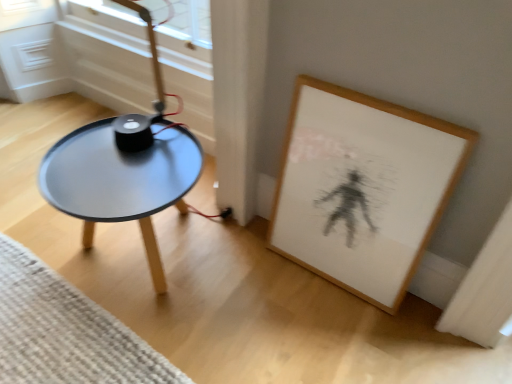
Where is `woven beige mat at lower left`? The height and width of the screenshot is (384, 512). woven beige mat at lower left is located at coordinates (65, 331).

Find the location of `wooden framed artwork at lower right`. wooden framed artwork at lower right is located at coordinates (366, 186).

This screenshot has width=512, height=384. Identify the location of woven beige mat at lower left. (65, 331).

From a real-world perspective, which is physically below, wooden framed artwork at lower right or matte black table at left?

matte black table at left, from a real-world perspective.

Considering the relative positions of wooden framed artwork at lower right and matte black table at left in the image provided, is wooden framed artwork at lower right to the right of matte black table at left from the viewer's perspective?

Yes, wooden framed artwork at lower right is to the right of matte black table at left.

Is wooden framed artwork at lower right touching matte black table at left?

No, wooden framed artwork at lower right is not making contact with matte black table at left.

Consider the image. Considering the sizes of objects wooden framed artwork at lower right and woven beige mat at lower left in the image provided, who is shorter, wooden framed artwork at lower right or woven beige mat at lower left?

With less height is woven beige mat at lower left.

Can you see wooden framed artwork at lower right touching woven beige mat at lower left?

wooden framed artwork at lower right and woven beige mat at lower left are not in contact.

From the picture: Is wooden framed artwork at lower right wider or thinner than woven beige mat at lower left?

Considering their sizes, wooden framed artwork at lower right looks slimmer than woven beige mat at lower left.

Considering the positions of objects wooden framed artwork at lower right and woven beige mat at lower left in the image provided, who is more to the right, wooden framed artwork at lower right or woven beige mat at lower left?

From the viewer's perspective, wooden framed artwork at lower right appears more on the right side.

Can you tell me how much woven beige mat at lower left and matte black table at left differ in facing direction?

The angle between the facing direction of woven beige mat at lower left and the facing direction of matte black table at left is 91.9 degrees.

In order to click on mat located on the left of matte black table at left in this screenshot , I will do click(x=65, y=331).

Considering the sizes of objects woven beige mat at lower left and matte black table at left in the image provided, who is smaller, woven beige mat at lower left or matte black table at left?

woven beige mat at lower left is smaller.

Can you see woven beige mat at lower left touching matte black table at left?

No, woven beige mat at lower left is not making contact with matte black table at left.

From a real-world perspective, is matte black table at left physically above woven beige mat at lower left?

Yes.

Is matte black table at left taller or shorter than woven beige mat at lower left?

matte black table at left is taller than woven beige mat at lower left.

From the image's perspective, is matte black table at left beneath woven beige mat at lower left?

Incorrect, from the image's perspective, matte black table at left is higher than woven beige mat at lower left.

Can you confirm if matte black table at left is bigger than woven beige mat at lower left?

Yes, matte black table at left is bigger than woven beige mat at lower left.

Is woven beige mat at lower left positioned far away from wooden framed artwork at lower right?

They are positioned close to each other.

Locate an element on the screen. The height and width of the screenshot is (384, 512). mat on the left side of wooden framed artwork at lower right is located at coordinates (65, 331).

What's the angular difference between woven beige mat at lower left and wooden framed artwork at lower right's facing directions?

woven beige mat at lower left and wooden framed artwork at lower right are facing 91 degrees away from each other.

Is point (63, 381) less distant than point (296, 230)?

Yes, point (63, 381) is closer to viewer.

You are a GUI agent. You are given a task and a screenshot of the screen. Output one action in this format:
    pyautogui.click(x=<x>, y=<y>)
    Task: Click on the picture frame above the matte black table at left (from the image's perspective)
    The width and height of the screenshot is (512, 384).
    Given the screenshot: What is the action you would take?
    pyautogui.click(x=366, y=186)

From the image's perspective, would you say matte black table at left is shown under wooden framed artwork at lower right?

Correct, matte black table at left appears lower than wooden framed artwork at lower right in the image.

Is matte black table at left positioned in front of wooden framed artwork at lower right?

No, matte black table at left is further to the viewer.

Consider the image. Is matte black table at left next to wooden framed artwork at lower right?

No.

Where is `coffee table lying on the left of wooden framed artwork at lower right`? This screenshot has height=384, width=512. coffee table lying on the left of wooden framed artwork at lower right is located at coordinates (120, 181).

The height and width of the screenshot is (384, 512). In order to click on picture frame above the woven beige mat at lower left (from the image's perspective) in this screenshot , I will do `click(366, 186)`.

Estimate the real-world distances between objects in this image. Which object is closer to woven beige mat at lower left, wooden framed artwork at lower right or matte black table at left?

Based on the image, matte black table at left appears to be nearer to woven beige mat at lower left.

Estimate the real-world distances between objects in this image. Which object is further from woven beige mat at lower left, matte black table at left or wooden framed artwork at lower right?

Based on the image, wooden framed artwork at lower right appears to be further to woven beige mat at lower left.

Estimate the real-world distances between objects in this image. Which object is further from wooden framed artwork at lower right, woven beige mat at lower left or matte black table at left?

woven beige mat at lower left is positioned further to the anchor wooden framed artwork at lower right.

Based on their spatial positions, is woven beige mat at lower left or wooden framed artwork at lower right further from matte black table at left?

Among the two, wooden framed artwork at lower right is located further to matte black table at left.

Looking at the image, which one is located further to matte black table at left, wooden framed artwork at lower right or woven beige mat at lower left?

wooden framed artwork at lower right lies further to matte black table at left than the other object.

Which object lies nearer to the anchor point wooden framed artwork at lower right, matte black table at left or woven beige mat at lower left?

The object closer to wooden framed artwork at lower right is matte black table at left.

Where is `coffee table between woven beige mat at lower left and wooden framed artwork at lower right in the horizontal direction`? Image resolution: width=512 pixels, height=384 pixels. coffee table between woven beige mat at lower left and wooden framed artwork at lower right in the horizontal direction is located at coordinates (120, 181).